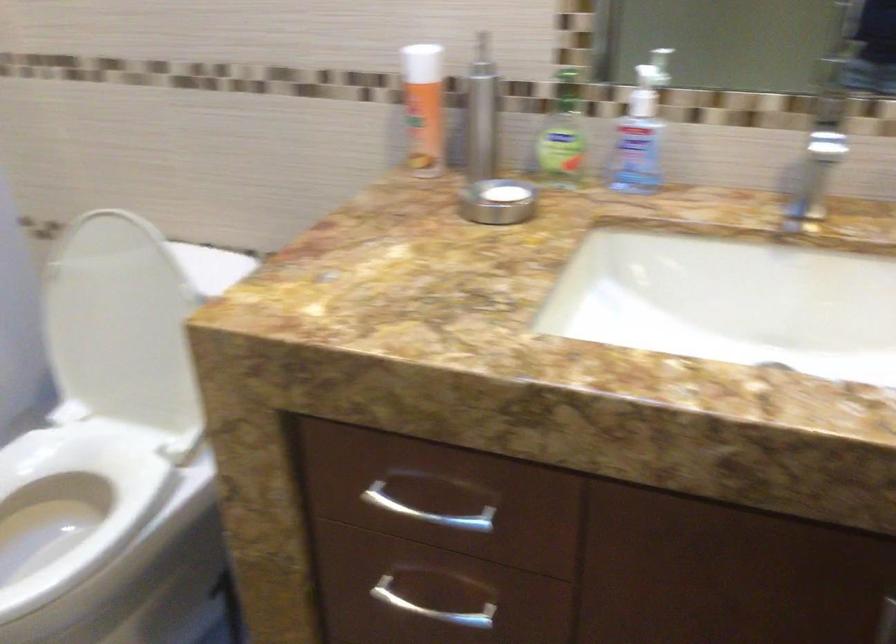
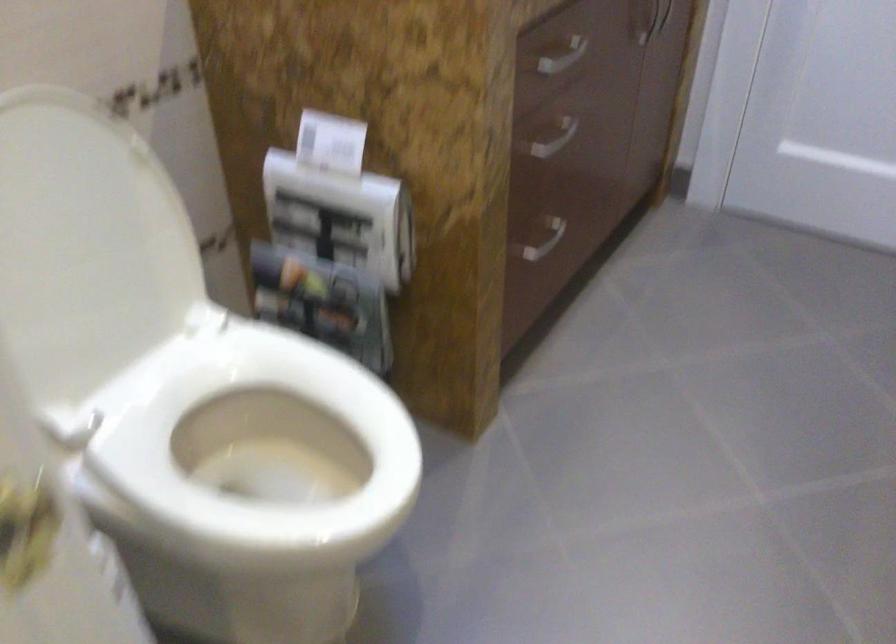
In the second image, find the point that corresponds to point 188,554 in the first image.

(257, 438)